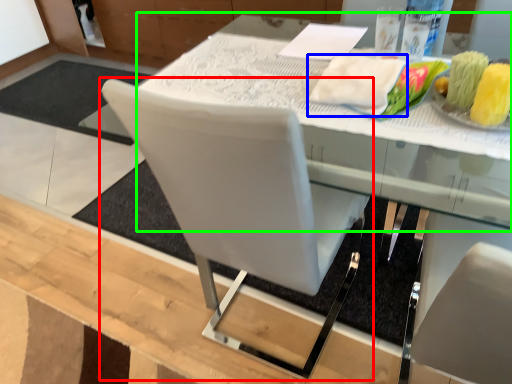
Question: Which is nearer to the chair (highlighted by a red box)? cloth (highlighted by a blue box) or round table (highlighted by a green box).

Choices:
 (A) cloth
 (B) round table

Answer: (B)